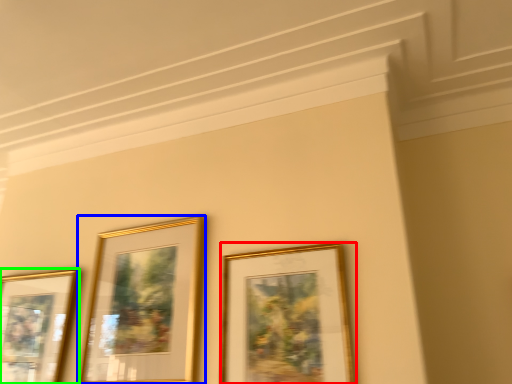
Question: Based on their relative distances, which object is farther from picture frame (highlighted by a red box)? Choose from picture frame (highlighted by a blue box) and picture frame (highlighted by a green box).

Choices:
 (A) picture frame
 (B) picture frame

Answer: (B)